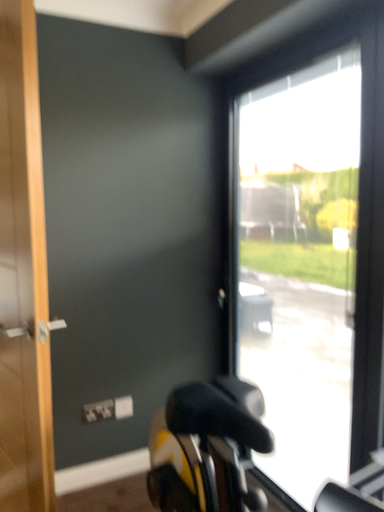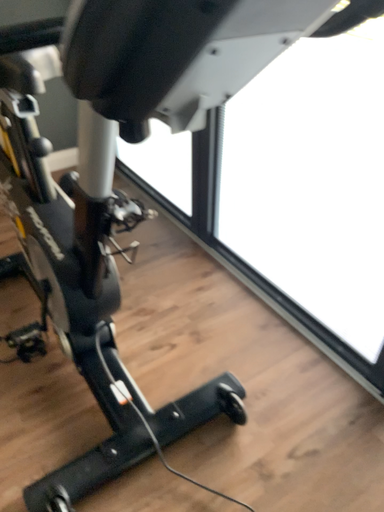
Question: Which way did the camera rotate in the video?

Choices:
 (A) rotated left
 (B) rotated right

Answer: (B)